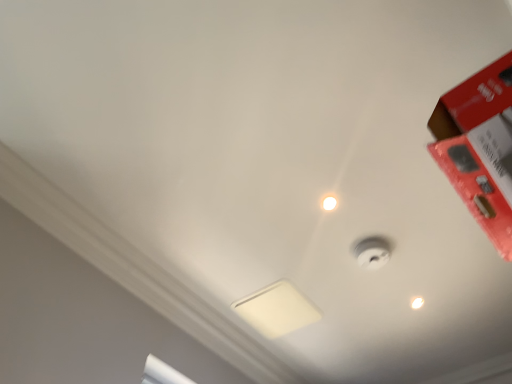
Question: From the image's perspective, would you say white matte lamp at center is positioned over white glossy light bulb at upper center?

Choices:
 (A) no
 (B) yes

Answer: (A)

Question: Is white matte lamp at center shorter than white glossy light bulb at upper center?

Choices:
 (A) yes
 (B) no

Answer: (A)

Question: Does white matte lamp at center come in front of white glossy light bulb at upper center?

Choices:
 (A) yes
 (B) no

Answer: (A)

Question: Is white matte lamp at center at the right side of white glossy light bulb at upper center?

Choices:
 (A) no
 (B) yes

Answer: (A)

Question: Would you say white matte lamp at center is a long distance from white glossy light bulb at upper center?

Choices:
 (A) yes
 (B) no

Answer: (B)

Question: From the image's perspective, is red matte box at upper right located above or below white glossy light bulb at upper center?

Choices:
 (A) below
 (B) above

Answer: (B)

Question: Is red matte box at upper right in front of or behind white glossy light bulb at upper center in the image?

Choices:
 (A) behind
 (B) front

Answer: (B)

Question: In terms of width, does red matte box at upper right look wider or thinner when compared to white glossy light bulb at upper center?

Choices:
 (A) wide
 (B) thin

Answer: (A)

Question: Does point tap(472, 117) appear closer or farther from the camera than point tap(413, 301)?

Choices:
 (A) closer
 (B) farther

Answer: (A)

Question: From a real-world perspective, is white glossy droplight at upper center physically located above or below white glossy light bulb at upper center?

Choices:
 (A) above
 (B) below

Answer: (A)

Question: Is point (329, 193) closer or farther from the camera than point (412, 302)?

Choices:
 (A) closer
 (B) farther

Answer: (A)

Question: In the image, is white glossy droplight at upper center on the left side or the right side of white glossy light bulb at upper center?

Choices:
 (A) left
 (B) right

Answer: (A)

Question: Looking at the image, does white glossy droplight at upper center seem bigger or smaller compared to white glossy light bulb at upper center?

Choices:
 (A) small
 (B) big

Answer: (B)

Question: Would you say white matte lamp at center is inside or outside white glossy droplight at upper center?

Choices:
 (A) inside
 (B) outside

Answer: (B)

Question: Based on their positions, is white matte lamp at center located to the left or right of white glossy droplight at upper center?

Choices:
 (A) left
 (B) right

Answer: (A)